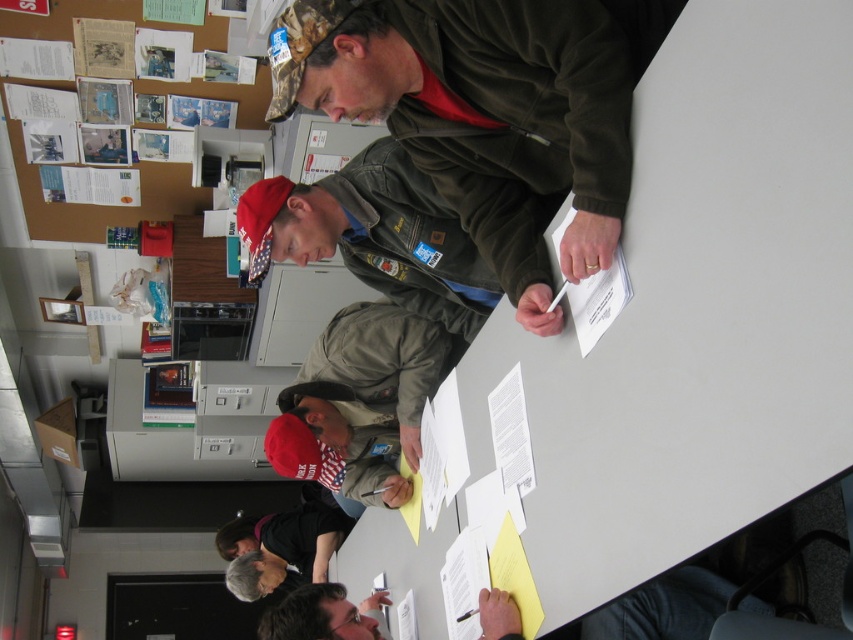
Question: Can you confirm if white matte table at center is thinner than brown paperboard at upper left?

Choices:
 (A) no
 (B) yes

Answer: (B)

Question: Which point appears farthest from the camera in this image?

Choices:
 (A) (10, 12)
 (B) (321, 625)
 (C) (265, 536)
 (D) (726, 326)

Answer: (C)

Question: Which of the following is the farthest from the observer?

Choices:
 (A) dark gray fabric shirt at lower center
 (B) dark gray shirt at lower center

Answer: (B)

Question: Estimate the real-world distances between objects in this image. Which object is closer to the brown paperboard at upper left?

Choices:
 (A) white matte table at center
 (B) dark gray shirt at lower center
 (C) dark gray fabric shirt at lower center

Answer: (B)

Question: Does white matte table at center appear on the left side of dark gray fabric shirt at lower center?

Choices:
 (A) no
 (B) yes

Answer: (B)

Question: Does dark gray fabric shirt at lower center lie behind dark gray shirt at lower center?

Choices:
 (A) no
 (B) yes

Answer: (A)